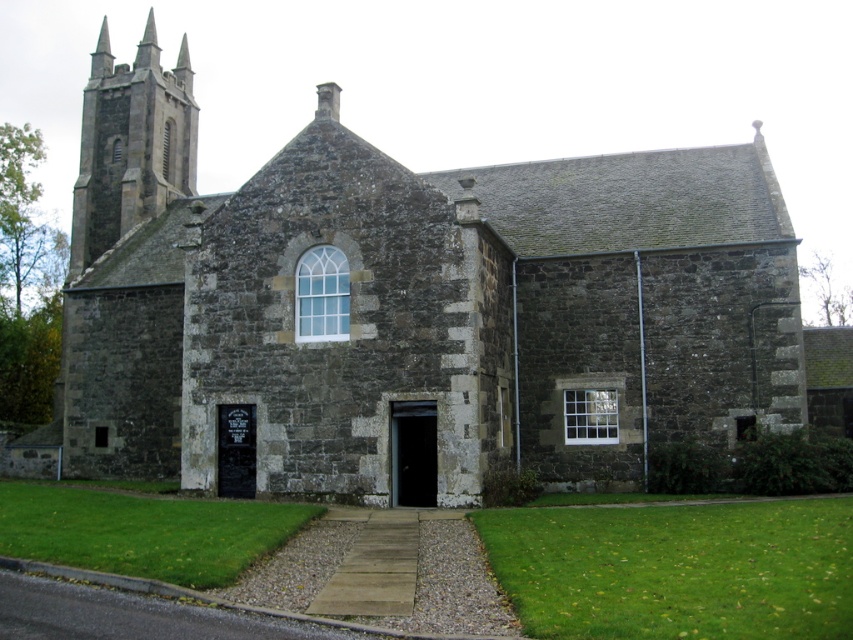
Image resolution: width=853 pixels, height=640 pixels. Describe the element at coordinates (409, 307) in the screenshot. I see `dark gray stone church at center` at that location.

Does point (335, 179) come farther from viewer compared to point (144, 182)?

No.

The width and height of the screenshot is (853, 640). What do you see at coordinates (409, 307) in the screenshot?
I see `dark gray stone church at center` at bounding box center [409, 307].

Locate an element on the screen. Image resolution: width=853 pixels, height=640 pixels. dark gray stone church at center is located at coordinates click(409, 307).